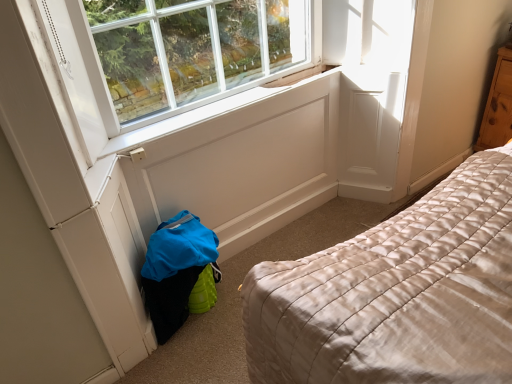
The width and height of the screenshot is (512, 384). Describe the element at coordinates (210, 111) in the screenshot. I see `white painted wood at center` at that location.

You are a GUI agent. You are given a task and a screenshot of the screen. Output one action in this format:
    pyautogui.click(x=<x>, y=<y>)
    Task: Click on the white painted wood at center
    The height and width of the screenshot is (384, 512).
    Given the screenshot: What is the action you would take?
    pyautogui.click(x=210, y=111)

What do you see at coordinates (498, 105) in the screenshot? I see `wooden dresser at right` at bounding box center [498, 105].

I want to click on wooden dresser at right, so click(498, 105).

Locate an element on the screen. Image resolution: width=512 pixels, height=384 pixels. white painted wood at center is located at coordinates coord(210,111).

Between white painted wood at center and wooden dresser at right, which one appears on the right side from the viewer's perspective?

wooden dresser at right is more to the right.

Consider the image. Does white painted wood at center lie in front of wooden dresser at right?

Yes, it is.

Considering the positions of point (159, 130) and point (509, 76), is point (159, 130) closer or farther from the camera than point (509, 76)?

Point (159, 130).

From the image's perspective, between white painted wood at center and wooden dresser at right, who is located below?

white painted wood at center is shown below in the image.

From a real-world perspective, is white painted wood at center located beneath wooden dresser at right?

Actually, white painted wood at center is physically above wooden dresser at right in the real world.

Considering the sizes of white painted wood at center and wooden dresser at right in the image, is white painted wood at center wider or thinner than wooden dresser at right?

In the image, white painted wood at center appears to be more narrow than wooden dresser at right.

Can you confirm if white painted wood at center is taller than wooden dresser at right?

No.

Between white painted wood at center and wooden dresser at right, which one has smaller size?

white painted wood at center.

From the picture: Can wooden dresser at right be found inside white painted wood at center?

No, white painted wood at center does not contain wooden dresser at right.

In the scene shown: Is white painted wood at center directly adjacent to wooden dresser at right?

No, white painted wood at center is not next to wooden dresser at right.

Is wooden dresser at right at the back of white painted wood at center?

No, white painted wood at center is not facing away from wooden dresser at right.

How different are the orientations of white painted wood at center and wooden dresser at right in degrees?

white painted wood at center and wooden dresser at right are facing 88.6 degrees away from each other.

The width and height of the screenshot is (512, 384). I want to click on dresser behind the white painted wood at center, so click(x=498, y=105).

Which is more to the left, wooden dresser at right or white painted wood at center?

Positioned to the left is white painted wood at center.

Looking at this image, is the depth of wooden dresser at right less than that of white painted wood at center?

No, wooden dresser at right is further to the viewer.

Which is in front, point (508, 75) or point (301, 84)?

Positioned in front is point (301, 84).

From the image's perspective, is wooden dresser at right located beneath white painted wood at center?

No, from the image's perspective, wooden dresser at right is not below white painted wood at center.

From a real-world perspective, is wooden dresser at right above or below white painted wood at center?

From a real-world perspective, wooden dresser at right is physically below white painted wood at center.

Between wooden dresser at right and white painted wood at center, which one has larger width?

wooden dresser at right is wider.

Does wooden dresser at right have a lesser height compared to white painted wood at center?

No, wooden dresser at right is not shorter than white painted wood at center.

Considering the sizes of wooden dresser at right and white painted wood at center in the image, is wooden dresser at right bigger or smaller than white painted wood at center?

wooden dresser at right is bigger than white painted wood at center.

Choose the correct answer: Is wooden dresser at right inside white painted wood at center or outside it?

wooden dresser at right is located beyond the bounds of white painted wood at center.

Is wooden dresser at right beside white painted wood at center?

No, wooden dresser at right is not with white painted wood at center.

Consider the image. Is wooden dresser at right oriented towards white painted wood at center?

No, wooden dresser at right does not turn towards white painted wood at center.

Based on the photo, how different are the orientations of wooden dresser at right and white painted wood at center in degrees?

wooden dresser at right and white painted wood at center are facing 88.6 degrees away from each other.

In the scene shown: Measure the distance from wooden dresser at right to white painted wood at center.

wooden dresser at right is 1.08 meters away from white painted wood at center.

This screenshot has height=384, width=512. In order to click on dresser to the right of white painted wood at center in this screenshot , I will do coord(498,105).

This screenshot has height=384, width=512. What are the coordinates of `window sill lying in front of the wooden dresser at right` in the screenshot? It's located at (210, 111).

I want to click on window sill that is below the wooden dresser at right (from the image's perspective), so 210,111.